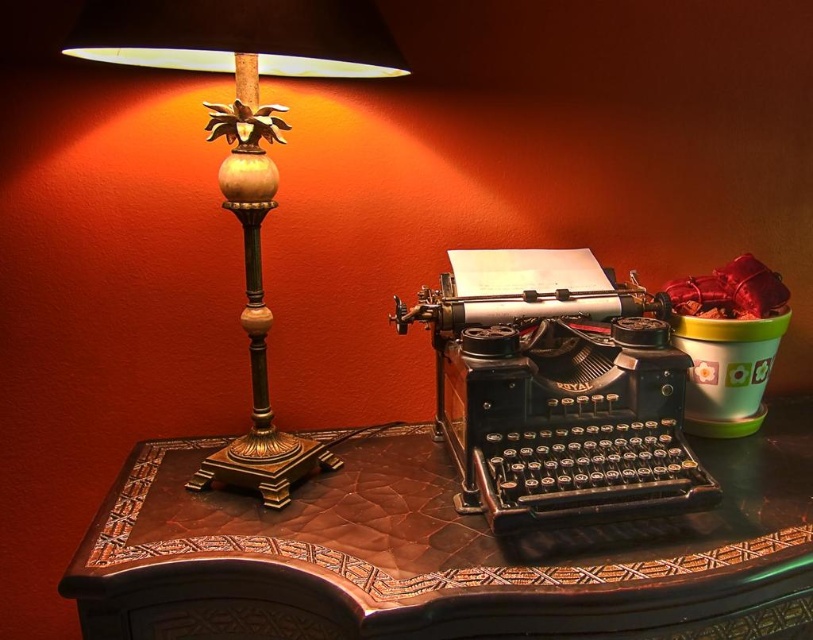
Measure the distance from brown leather table at center to gold-bronze table lamp at left.

brown leather table at center and gold-bronze table lamp at left are 14.33 inches apart from each other.

From the picture: Does brown leather table at center have a larger size compared to gold-bronze table lamp at left?

Correct, brown leather table at center is larger in size than gold-bronze table lamp at left.

Is point (646, 561) less distant than point (277, 481)?

Yes, point (646, 561) is closer to viewer.

Image resolution: width=813 pixels, height=640 pixels. Find the location of `brown leather table at center`. brown leather table at center is located at coordinates (433, 550).